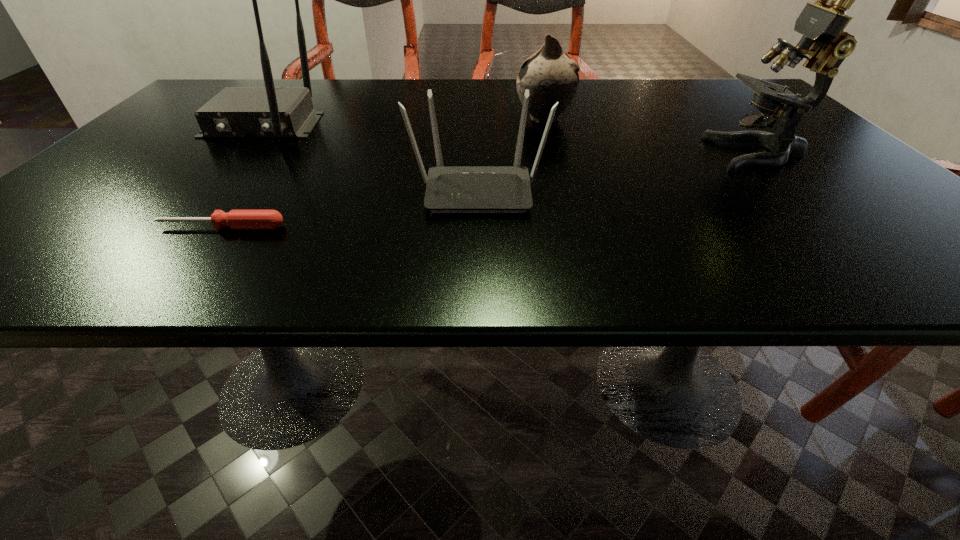
Find the location of `the rightmost object`. the rightmost object is located at coordinates (821, 23).

Locate an element on the screen. This screenshot has width=960, height=540. the tallest object is located at coordinates tap(821, 23).

You are a GUI agent. You are given a task and a screenshot of the screen. Output one action in this format:
    pyautogui.click(x=<x>, y=<y>)
    Task: Click on the left router
    The width and height of the screenshot is (960, 540).
    Given the screenshot: What is the action you would take?
    pyautogui.click(x=269, y=111)

I want to click on the farther router, so click(x=269, y=111).

Locate an element on the screen. pottery is located at coordinates (550, 76).

The image size is (960, 540). Find the location of `the right router`. the right router is located at coordinates (450, 189).

Locate an element on the screen. The height and width of the screenshot is (540, 960). the shorter router is located at coordinates (450, 189).

In order to click on screwdriver in this screenshot , I will do `click(236, 219)`.

Where is `the nearest object`? The image size is (960, 540). the nearest object is located at coordinates (236, 219).

The width and height of the screenshot is (960, 540). I want to click on free space located at the eyepieces of the microscope, so point(646,153).